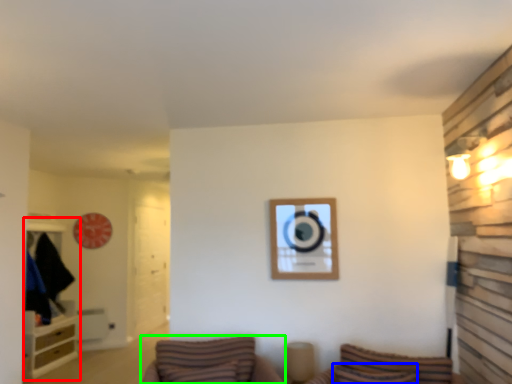
Question: Which object is the farthest from entertainment center (highlighted by a red box)? Choose among these: pillow (highlighted by a blue box) or furniture (highlighted by a green box).

Choices:
 (A) pillow
 (B) furniture

Answer: (A)